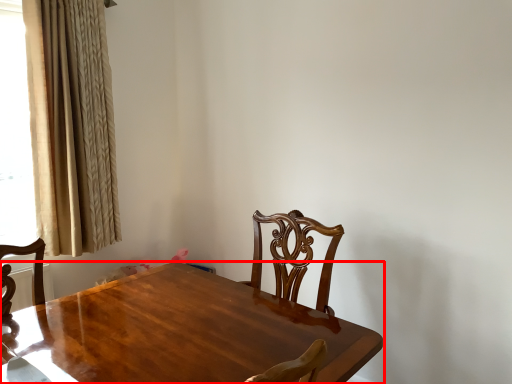
Question: From the image's perspective, where is table (annotated by the red box) located in relation to curtain in the image?

Choices:
 (A) above
 (B) below

Answer: (B)